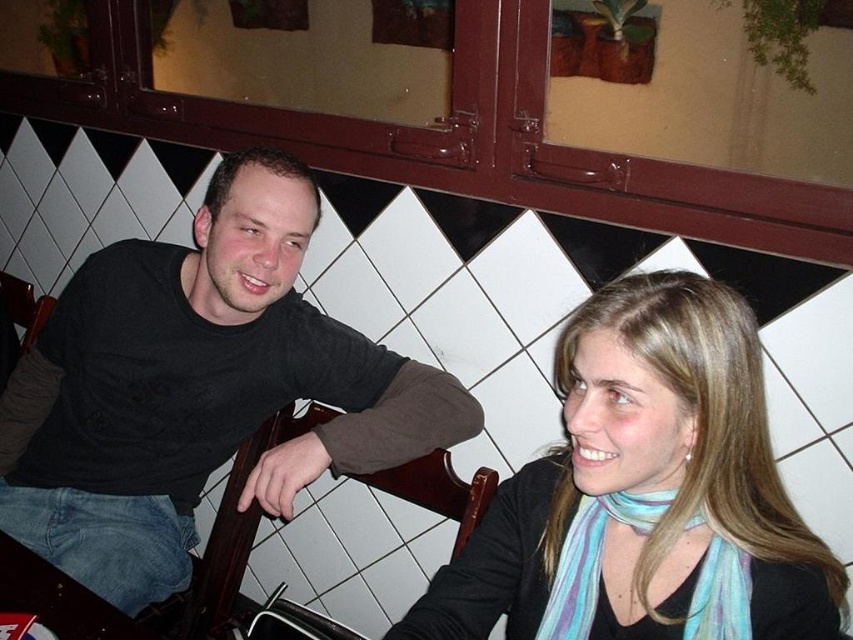
Who is more forward, (271, 257) or (460, 600)?

Point (460, 600) is in front.

Identify the location of black cotton shirt at center. This screenshot has height=640, width=853. (198, 388).

Where is `black cotton shirt at center`? The image size is (853, 640). black cotton shirt at center is located at coordinates (198, 388).